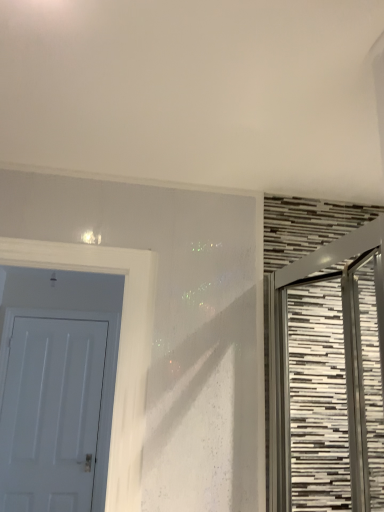
Question: Should I look upward or downward to see white matte door at left, acting as the 2th door starting from the front?

Choices:
 (A) up
 (B) down

Answer: (B)

Question: Is metallic textured door at right, the 1th door in the right-to-left sequence, at the left side of white matte door at left, which appears as the 1th door when viewed from the left?

Choices:
 (A) yes
 (B) no

Answer: (B)

Question: Is metallic textured door at right, the 2th door positioned from the left, wider than white matte door at left, acting as the 2th door starting from the front?

Choices:
 (A) no
 (B) yes

Answer: (B)

Question: From a real-world perspective, is metallic textured door at right, the first door from the front, below white matte door at left, acting as the 2th door starting from the front?

Choices:
 (A) no
 (B) yes

Answer: (A)

Question: Is metallic textured door at right, the first door from the front, shorter than white matte door at left, the first door positioned from the back?

Choices:
 (A) no
 (B) yes

Answer: (B)

Question: Is the depth of metallic textured door at right, which appears as the 2th door when viewed from the back, greater than that of white matte door at left, which appears as the 1th door when viewed from the left?

Choices:
 (A) no
 (B) yes

Answer: (A)

Question: Does metallic textured door at right, the 1th door in the right-to-left sequence, have a larger size compared to white matte door at left, acting as the 2th door starting from the front?

Choices:
 (A) yes
 (B) no

Answer: (A)

Question: Considering the relative sizes of white matte door at left, the first door positioned from the back, and metallic textured door at right, the first door from the front, in the image provided, is white matte door at left, the first door positioned from the back, thinner than metallic textured door at right, the first door from the front,?

Choices:
 (A) yes
 (B) no

Answer: (A)

Question: From the image's perspective, is white matte door at left, the first door positioned from the back, located beneath metallic textured door at right, the first door from the front?

Choices:
 (A) no
 (B) yes

Answer: (B)

Question: Is the position of white matte door at left, which ranks as the 2th door in right-to-left order, less distant than that of metallic textured door at right, the first door from the front?

Choices:
 (A) no
 (B) yes

Answer: (A)

Question: Is white matte door at left, the first door positioned from the back, placed right next to metallic textured door at right, the 1th door in the right-to-left sequence?

Choices:
 (A) no
 (B) yes

Answer: (A)

Question: Does white matte door at left, acting as the 2th door starting from the front, have a greater width compared to metallic textured door at right, the 1th door in the right-to-left sequence?

Choices:
 (A) yes
 (B) no

Answer: (B)

Question: Is there a large distance between white matte door at left, which ranks as the 2th door in right-to-left order, and metallic textured door at right, the first door from the front?

Choices:
 (A) yes
 (B) no

Answer: (A)

Question: Considering the relative positions of metallic textured door at right, the first door from the front, and white matte door at left, acting as the 2th door starting from the front, in the image provided, is metallic textured door at right, the first door from the front, to the left or to the right of white matte door at left, acting as the 2th door starting from the front,?

Choices:
 (A) right
 (B) left

Answer: (A)